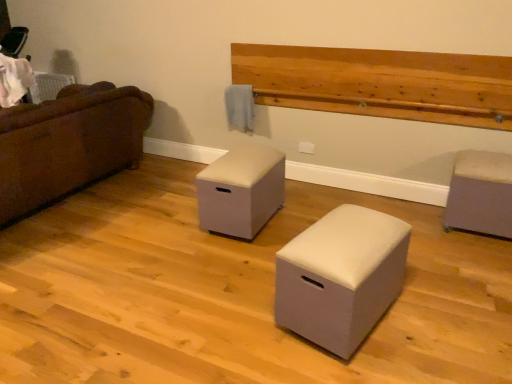
Describe the element at coordinates (380, 83) in the screenshot. This screenshot has width=512, height=384. I see `natural wood plank at upper center` at that location.

You are a GUI agent. You are given a task and a screenshot of the screen. Output one action in this format:
    pyautogui.click(x=<x>, y=<y>)
    Task: Click on the white fabric ottoman at center, which is the 2th furniture in right-to-left order
    This screenshot has width=512, height=384.
    Given the screenshot: What is the action you would take?
    pyautogui.click(x=341, y=277)

Identify the location of brown fabric couch at left. (68, 144).

Locate an element on the screen. This screenshot has height=384, width=512. natural wood plank at upper center is located at coordinates pos(380,83).

Which is closer, (x=454, y=60) or (x=326, y=283)?

Point (x=454, y=60).

Is natural wood plank at upper center wider or thinner than white fabric ottoman at center, acting as the 2th furniture starting from the left?

In the image, natural wood plank at upper center appears to be more narrow than white fabric ottoman at center, acting as the 2th furniture starting from the left.

Is natural wood plank at upper center far away from white fabric ottoman at center, acting as the 2th furniture starting from the left?

Yes.

Which object is positioned more to the left, natural wood plank at upper center or white fabric ottoman at center, which is the 2th furniture in right-to-left order?

From the viewer's perspective, white fabric ottoman at center, which is the 2th furniture in right-to-left order, appears more on the left side.

Considering the relative sizes of matte gray ottoman at right, the first furniture when ordered from right to left, and brown fabric couch at left in the image provided, is matte gray ottoman at right, the first furniture when ordered from right to left, thinner than brown fabric couch at left?

Yes.

Which is correct: matte gray ottoman at right, the first furniture when ordered from right to left, is inside brown fabric couch at left, or outside of it?

matte gray ottoman at right, the first furniture when ordered from right to left, is not inside brown fabric couch at left, it's outside.

You are a GUI agent. You are given a task and a screenshot of the screen. Output one action in this format:
    pyautogui.click(x=<x>, y=<y>)
    Task: Click on the studio couch that is on the left side of matte gray ottoman at right, the first furniture when ordered from right to left
    The height and width of the screenshot is (384, 512).
    Given the screenshot: What is the action you would take?
    pyautogui.click(x=68, y=144)

How much distance is there between matte gray ottoman at right, the first furniture when ordered from right to left, and brown fabric couch at left?

9.33 feet.

From the image's perspective, is white fabric ottoman at center, which is the 2th furniture in right-to-left order, positioned above or below matte gray ottoman at right, which appears as the 3th furniture when viewed from the left?

Clearly, from the image's perspective, white fabric ottoman at center, which is the 2th furniture in right-to-left order, is below matte gray ottoman at right, which appears as the 3th furniture when viewed from the left.

Can you confirm if white fabric ottoman at center, acting as the 2th furniture starting from the left, is bigger than matte gray ottoman at right, which appears as the 3th furniture when viewed from the left?

Indeed, white fabric ottoman at center, acting as the 2th furniture starting from the left, has a larger size compared to matte gray ottoman at right, which appears as the 3th furniture when viewed from the left.

Is white fabric ottoman at center, acting as the 2th furniture starting from the left, located outside matte gray ottoman at right, which appears as the 3th furniture when viewed from the left?

Absolutely, white fabric ottoman at center, acting as the 2th furniture starting from the left, is external to matte gray ottoman at right, which appears as the 3th furniture when viewed from the left.

Is point (306, 260) positioned before point (449, 195)?

Yes, point (306, 260) is in front of point (449, 195).

Can you confirm if matte gray ottoman at right, which appears as the 3th furniture when viewed from the left, is smaller than beige fabric ottoman at center, which is counted as the 1th furniture, starting from the left?

Correct, matte gray ottoman at right, which appears as the 3th furniture when viewed from the left, occupies less space than beige fabric ottoman at center, which is counted as the 1th furniture, starting from the left.

Is matte gray ottoman at right, the first furniture when ordered from right to left, in front of or behind beige fabric ottoman at center, which is the 3th furniture from right to left, in the image?

In the image, matte gray ottoman at right, the first furniture when ordered from right to left, appears behind beige fabric ottoman at center, which is the 3th furniture from right to left.

Where is `furniture that is behind the beige fabric ottoman at center, which is the 3th furniture from right to left`? furniture that is behind the beige fabric ottoman at center, which is the 3th furniture from right to left is located at coordinates (480, 193).

Is beige fabric ottoman at center, which is the 3th furniture from right to left, further to the viewer compared to white fabric ottoman at center, acting as the 2th furniture starting from the left?

Yes, it is behind white fabric ottoman at center, acting as the 2th furniture starting from the left.

Can you confirm if beige fabric ottoman at center, which is the 3th furniture from right to left, is smaller than white fabric ottoman at center, which is the 2th furniture in right-to-left order?

Correct, beige fabric ottoman at center, which is the 3th furniture from right to left, occupies less space than white fabric ottoman at center, which is the 2th furniture in right-to-left order.

From the picture: Which object is wider, beige fabric ottoman at center, which is the 3th furniture from right to left, or white fabric ottoman at center, which is the 2th furniture in right-to-left order?

Wider between the two is beige fabric ottoman at center, which is the 3th furniture from right to left.

Is beige fabric ottoman at center, which is the 3th furniture from right to left, not near white fabric ottoman at center, acting as the 2th furniture starting from the left?

No, beige fabric ottoman at center, which is the 3th furniture from right to left, is not far away from white fabric ottoman at center, acting as the 2th furniture starting from the left.

In the scene shown: Does white fabric ottoman at center, acting as the 2th furniture starting from the left, turn towards brown fabric couch at left?

Yes, white fabric ottoman at center, acting as the 2th furniture starting from the left, is oriented towards brown fabric couch at left.

Which object is positioned more to the right, white fabric ottoman at center, which is the 2th furniture in right-to-left order, or brown fabric couch at left?

Positioned to the right is white fabric ottoman at center, which is the 2th furniture in right-to-left order.

Is white fabric ottoman at center, which is the 2th furniture in right-to-left order, situated inside brown fabric couch at left or outside?

white fabric ottoman at center, which is the 2th furniture in right-to-left order, lies outside brown fabric couch at left.

Considering the relative positions of white fabric ottoman at center, acting as the 2th furniture starting from the left, and beige fabric ottoman at center, which is the 3th furniture from right to left, in the image provided, is white fabric ottoman at center, acting as the 2th furniture starting from the left, to the left of beige fabric ottoman at center, which is the 3th furniture from right to left, from the viewer's perspective?

In fact, white fabric ottoman at center, acting as the 2th furniture starting from the left, is to the right of beige fabric ottoman at center, which is the 3th furniture from right to left.

Is white fabric ottoman at center, which is the 2th furniture in right-to-left order, further to camera compared to beige fabric ottoman at center, which is the 3th furniture from right to left?

No, white fabric ottoman at center, which is the 2th furniture in right-to-left order, is closer to the camera.

From a real-world perspective, is white fabric ottoman at center, acting as the 2th furniture starting from the left, beneath beige fabric ottoman at center, which is counted as the 1th furniture, starting from the left?

Yes, from a real-world perspective, white fabric ottoman at center, acting as the 2th furniture starting from the left, is below beige fabric ottoman at center, which is counted as the 1th furniture, starting from the left.

How distant is white fabric ottoman at center, acting as the 2th furniture starting from the left, from beige fabric ottoman at center, which is the 3th furniture from right to left?

white fabric ottoman at center, acting as the 2th furniture starting from the left, and beige fabric ottoman at center, which is the 3th furniture from right to left, are 36.13 inches apart from each other.

In order to click on the 3rd furniture located beneath the natural wood plank at upper center (from a real-world perspective) in this screenshot , I will do `click(341, 277)`.

You are a GUI agent. You are given a task and a screenshot of the screen. Output one action in this format:
    pyautogui.click(x=<x>, y=<y>)
    Task: Click on the studio couch on the left of matte gray ottoman at right, which appears as the 3th furniture when viewed from the left
    This screenshot has width=512, height=384.
    Given the screenshot: What is the action you would take?
    pyautogui.click(x=68, y=144)

Based on their spatial positions, is beige fabric ottoman at center, which is counted as the 1th furniture, starting from the left, or natural wood plank at upper center closer to matte gray ottoman at right, the first furniture when ordered from right to left?

natural wood plank at upper center is positioned closer to the anchor matte gray ottoman at right, the first furniture when ordered from right to left.

Based on their spatial positions, is matte gray ottoman at right, the first furniture when ordered from right to left, or beige fabric ottoman at center, which is counted as the 1th furniture, starting from the left, closer to natural wood plank at upper center?

Among the two, matte gray ottoman at right, the first furniture when ordered from right to left, is located nearer to natural wood plank at upper center.

Estimate the real-world distances between objects in this image. Which object is closer to natural wood plank at upper center, brown fabric couch at left or white fabric ottoman at center, which is the 2th furniture in right-to-left order?

white fabric ottoman at center, which is the 2th furniture in right-to-left order, is closer to natural wood plank at upper center.

Looking at this image, from the image, which object appears to be nearer to white fabric ottoman at center, acting as the 2th furniture starting from the left, natural wood plank at upper center or matte gray ottoman at right, the first furniture when ordered from right to left?

matte gray ottoman at right, the first furniture when ordered from right to left, lies closer to white fabric ottoman at center, acting as the 2th furniture starting from the left, than the other object.

Considering their positions, is natural wood plank at upper center positioned further to beige fabric ottoman at center, which is counted as the 1th furniture, starting from the left, than matte gray ottoman at right, which appears as the 3th furniture when viewed from the left?

Among the two, matte gray ottoman at right, which appears as the 3th furniture when viewed from the left, is located further to beige fabric ottoman at center, which is counted as the 1th furniture, starting from the left.

Looking at the image, which one is located closer to matte gray ottoman at right, which appears as the 3th furniture when viewed from the left, brown fabric couch at left or beige fabric ottoman at center, which is the 3th furniture from right to left?

beige fabric ottoman at center, which is the 3th furniture from right to left.

Based on their spatial positions, is natural wood plank at upper center or beige fabric ottoman at center, which is the 3th furniture from right to left, closer to brown fabric couch at left?

Among the two, beige fabric ottoman at center, which is the 3th furniture from right to left, is located nearer to brown fabric couch at left.

Considering their positions, is matte gray ottoman at right, the first furniture when ordered from right to left, positioned closer to beige fabric ottoman at center, which is counted as the 1th furniture, starting from the left, than natural wood plank at upper center?

natural wood plank at upper center is closer to beige fabric ottoman at center, which is counted as the 1th furniture, starting from the left.

Image resolution: width=512 pixels, height=384 pixels. Find the location of `furniture located between brown fabric couch at left and white fabric ottoman at center, acting as the 2th furniture starting from the left, in the left-right direction`. furniture located between brown fabric couch at left and white fabric ottoman at center, acting as the 2th furniture starting from the left, in the left-right direction is located at coordinates (241, 191).

Where is `hardwood located between brown fabric couch at left and matte gray ottoman at right, which appears as the 3th furniture when viewed from the left, in the left-right direction`? hardwood located between brown fabric couch at left and matte gray ottoman at right, which appears as the 3th furniture when viewed from the left, in the left-right direction is located at coordinates (380, 83).

What are the coordinates of `hardwood situated between beige fabric ottoman at center, which is the 3th furniture from right to left, and matte gray ottoman at right, the first furniture when ordered from right to left, from left to right` in the screenshot? It's located at (380, 83).

What are the coordinates of `furniture located between beige fabric ottoman at center, which is counted as the 1th furniture, starting from the left, and matte gray ottoman at right, which appears as the 3th furniture when viewed from the left, in the left-right direction` in the screenshot? It's located at (341, 277).